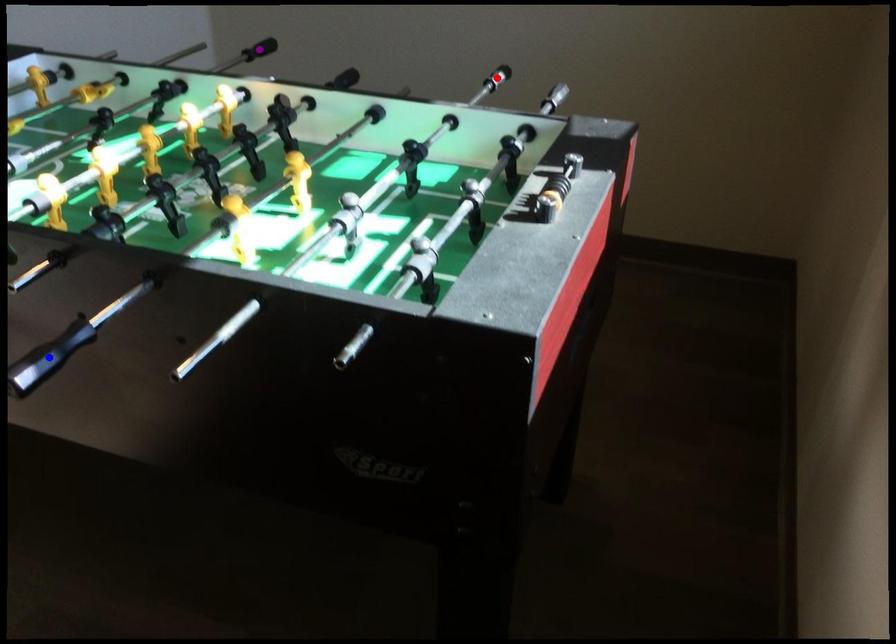
Order these from nearest to farthest:
1. red point
2. purple point
3. blue point

blue point → red point → purple point